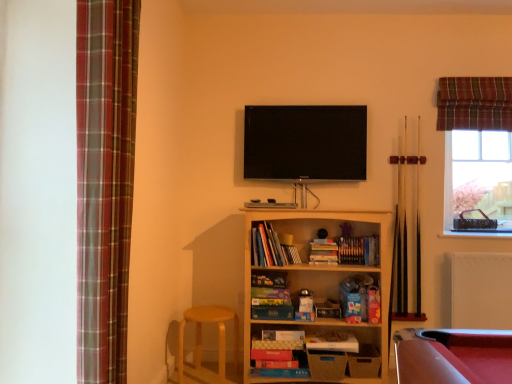
Question: Is wooden pool cue at right, which is counted as the 2th cue, starting from the left, to the left or to the right of brown wooden pool cue at right, marked as the first cue in a left-to-right arrangement, in the image?

Choices:
 (A) right
 (B) left

Answer: (A)

Question: Relative to brown wooden pool cue at right, arranged as the second cue when viewed from the right, is wooden pool cue at right, placed as the 1th cue when sorted from right to left, in front or behind?

Choices:
 (A) behind
 (B) front

Answer: (B)

Question: Estimate the real-world distances between objects in this image. Which object is closer to the wooden pool cue at right, placed as the 1th cue when sorted from right to left?

Choices:
 (A) flat screen tv at upper center
 (B) matte cardboard book at center, which is counted as the first book, starting from the bottom
 (C) plaid fabric curtain at left, the 1th curtain viewed from the front
 (D) hardcover books at center, marked as the second book in a bottom-to-top arrangement
 (E) clear glass window at upper right

Answer: (E)

Question: Estimate the real-world distances between objects in this image. Which object is closer to the matte cardboard book at center, placed as the 1th book when sorted from right to left?

Choices:
 (A) hardcover books at center, the first book positioned from the top
 (B) wooden pool cue at right, which is counted as the 2th cue, starting from the left
 (C) hardcover books at center, which ranks as the second book in top-to-bottom order
 (D) light brown wood stool at lower left
 (E) brown wooden pool cue at right, marked as the first cue in a left-to-right arrangement

Answer: (C)